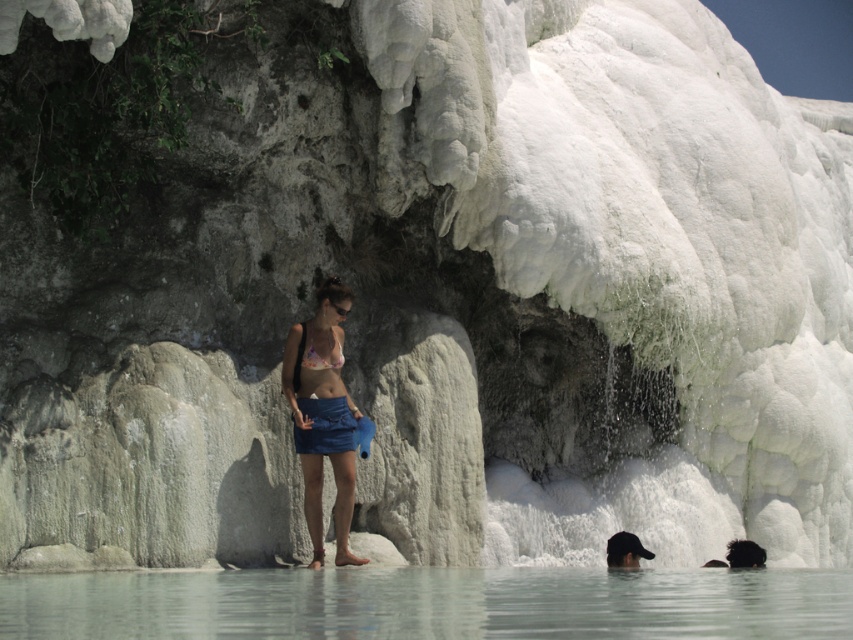
You are a photographer positioned at the camera location. You want to capture a closeup shot of the black matte cap at lower center. Given that your camera can focus on objects within 40 meters, will you need to adjust your position to get a clear shot?

The black matte cap at lower center is 45.61 meters away from the camera, which is beyond the camera focus range of 40 meters. You need to move closer to the black matte cap at lower center to ensure it is within the 40 meters range for a clear shot.

You are a photographer taking a picture of the person in the scene. You need to ensure the blue fabric skirt at center and the matte white bikini top at center are both visible. Which object should you focus on first to make sure the other is in focus?

The blue fabric skirt at center is positioned under the matte white bikini top at center. Since they are layered, focusing on the matte white bikini top at center will ensure the blue fabric skirt at center is also in focus as it is behind.